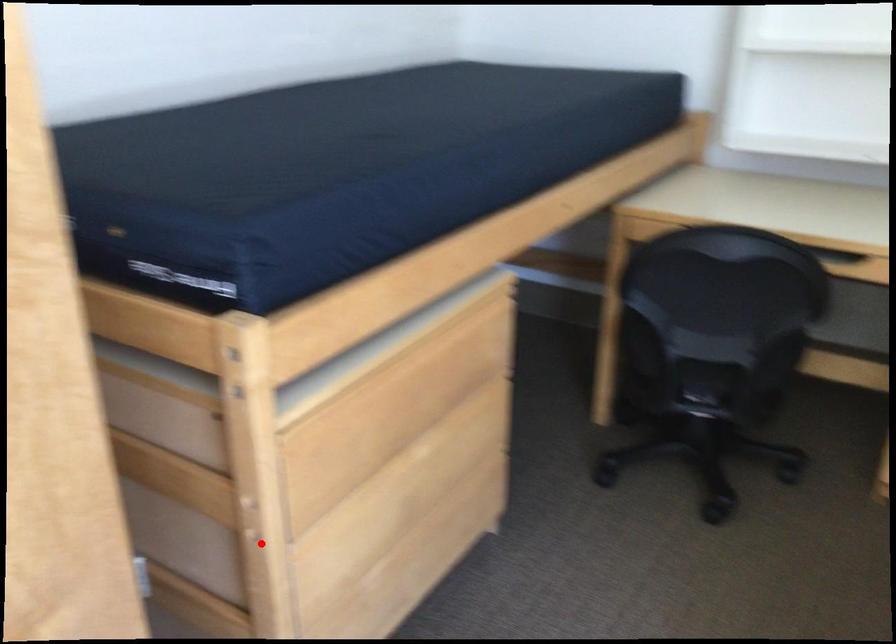
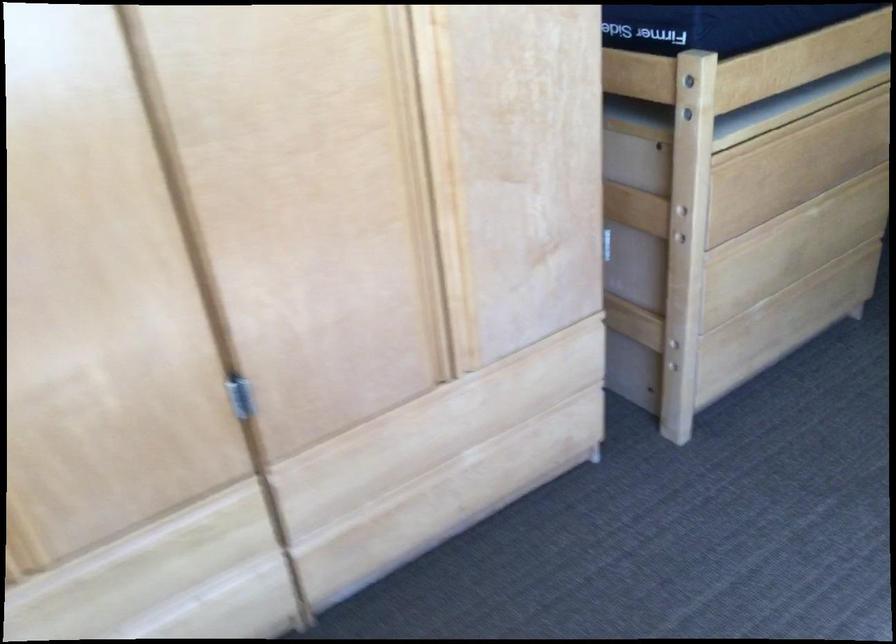
Where in the second image is the point corresponding to the highlighted location from the first image?

(682, 240)